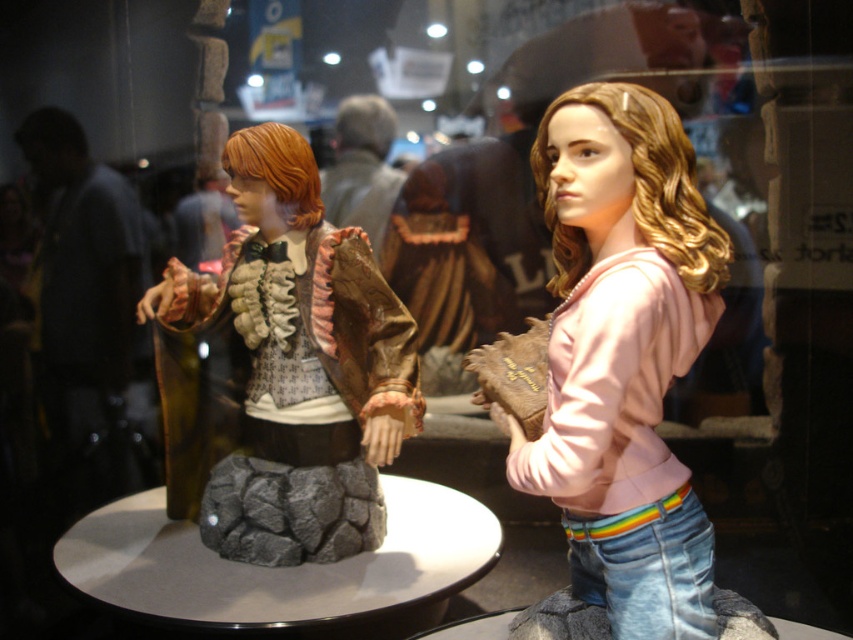
Between point (648, 202) and point (383, 429), which one is positioned behind?

Positioned behind is point (383, 429).

Between point (711, 243) and point (401, 413), which one is positioned in front?

Positioned in front is point (711, 243).

Where is `pink matte hoodie at center`? The height and width of the screenshot is (640, 853). pink matte hoodie at center is located at coordinates (624, 355).